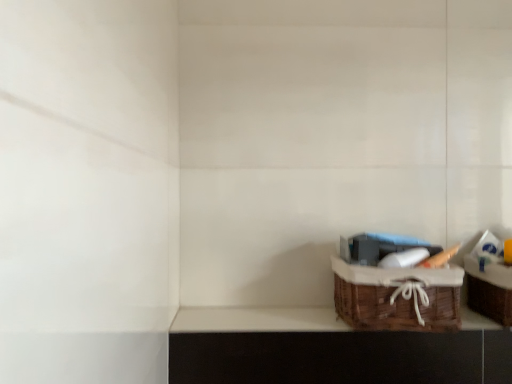
Question: Is brown wicker basket at lower right thinner than woven brown basket at lower right?

Choices:
 (A) no
 (B) yes

Answer: (B)

Question: Would you say brown wicker basket at lower right is a long distance from woven brown basket at lower right?

Choices:
 (A) no
 (B) yes

Answer: (A)

Question: Considering the relative positions of brown wicker basket at lower right and woven brown basket at lower right in the image provided, is brown wicker basket at lower right to the right of woven brown basket at lower right from the viewer's perspective?

Choices:
 (A) yes
 (B) no

Answer: (B)

Question: Is brown wicker basket at lower right located outside woven brown basket at lower right?

Choices:
 (A) no
 (B) yes

Answer: (B)

Question: Considering the relative positions of brown wicker basket at lower right and woven brown basket at lower right in the image provided, is brown wicker basket at lower right in front of woven brown basket at lower right?

Choices:
 (A) no
 (B) yes

Answer: (A)

Question: Can woven brown basket at lower right be found inside brown wicker basket at lower right?

Choices:
 (A) no
 (B) yes

Answer: (A)

Question: Considering the relative sizes of brown wicker basket at lower right and woven brown picnic basket at lower right in the image provided, is brown wicker basket at lower right thinner than woven brown picnic basket at lower right?

Choices:
 (A) yes
 (B) no

Answer: (A)

Question: Does brown wicker basket at lower right lie behind woven brown picnic basket at lower right?

Choices:
 (A) no
 (B) yes

Answer: (B)

Question: Is brown wicker basket at lower right smaller than woven brown picnic basket at lower right?

Choices:
 (A) yes
 (B) no

Answer: (A)

Question: Does brown wicker basket at lower right lie in front of woven brown picnic basket at lower right?

Choices:
 (A) no
 (B) yes

Answer: (A)

Question: Considering the relative positions of brown wicker basket at lower right and woven brown picnic basket at lower right in the image provided, is brown wicker basket at lower right to the right of woven brown picnic basket at lower right from the viewer's perspective?

Choices:
 (A) no
 (B) yes

Answer: (A)

Question: Is brown wicker basket at lower right bigger than woven brown picnic basket at lower right?

Choices:
 (A) no
 (B) yes

Answer: (A)

Question: Is woven brown basket at lower right not near brown wicker basket at lower right?

Choices:
 (A) yes
 (B) no

Answer: (B)